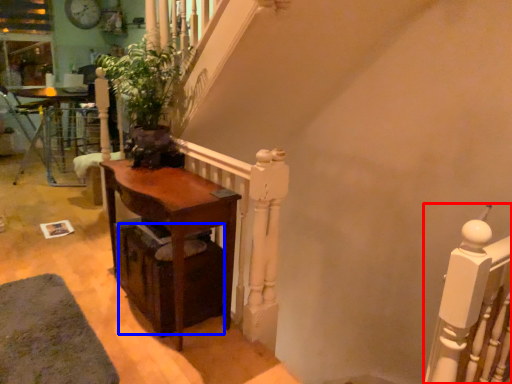
Question: Which of the following is the farthest to the observer, rail (highlighted by a red box) or drawer (highlighted by a blue box)?

Choices:
 (A) rail
 (B) drawer

Answer: (B)